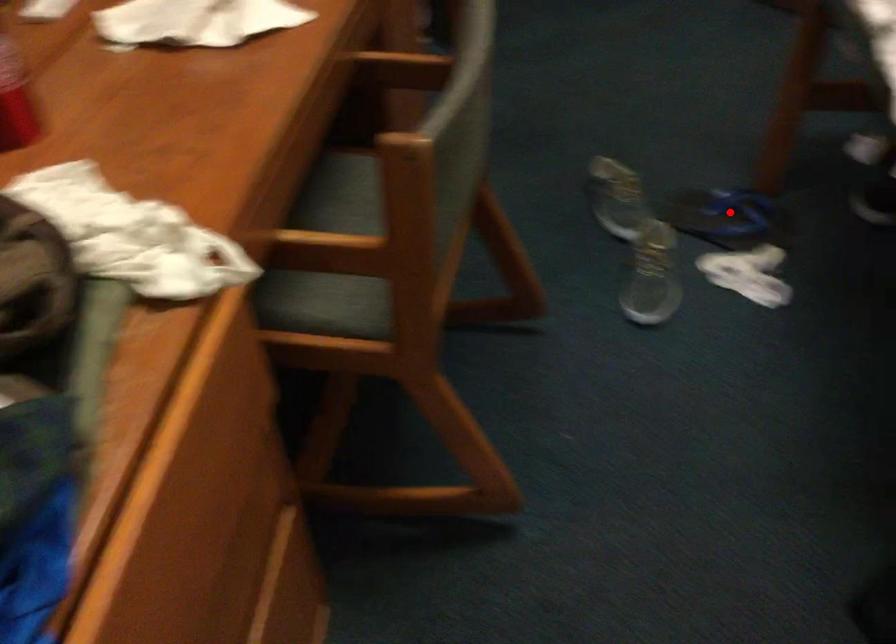
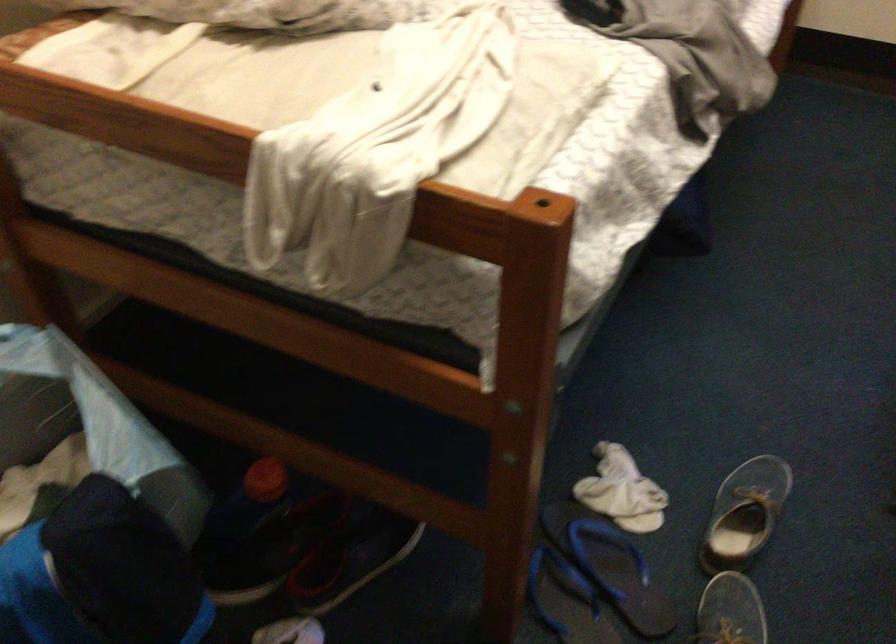
Question: I am providing you with two images of the same scene from different viewpoints. Given a red point in image1, look at the same physical point in image2. Is it:

Choices:
 (A) Closer to the viewpoint
 (B) Farther from the viewpoint

Answer: (A)